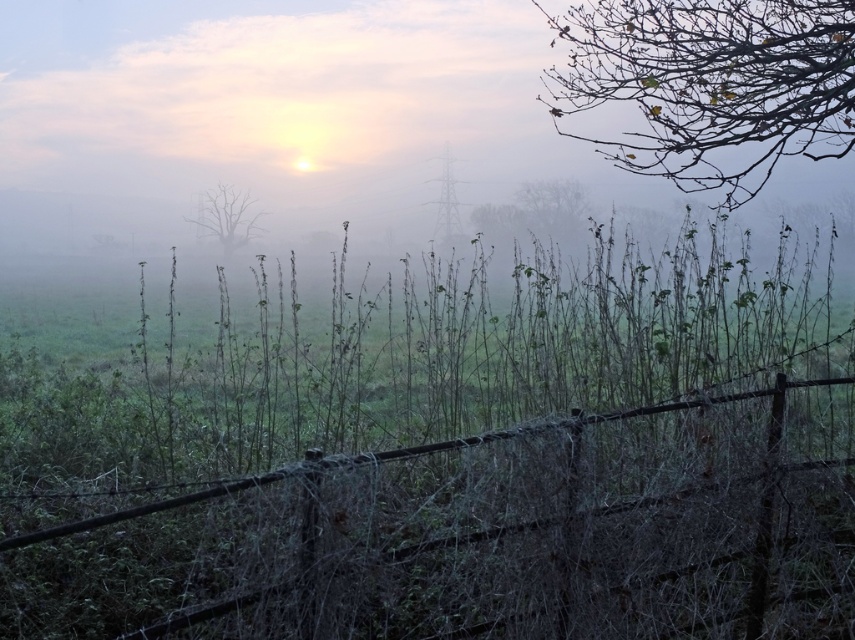
Question: Which of the following is the farthest from the observer?

Choices:
 (A) brown leafy branches at upper right
 (B) bare branches at center
 (C) rusty wire fence at center

Answer: (B)

Question: Does rusty wire fence at center appear on the right side of brown leafy branches at upper right?

Choices:
 (A) yes
 (B) no

Answer: (B)

Question: Among these objects, which one is farthest from the camera?

Choices:
 (A) bare branches at center
 (B) brown leafy branches at upper right

Answer: (A)

Question: Is rusty wire fence at center further to camera compared to bare branches at center?

Choices:
 (A) no
 (B) yes

Answer: (A)

Question: Among these objects, which one is farthest from the camera?

Choices:
 (A) bare branches at center
 (B) rusty wire fence at center

Answer: (A)

Question: Does brown leafy branches at upper right have a larger size compared to bare branches at center?

Choices:
 (A) yes
 (B) no

Answer: (A)